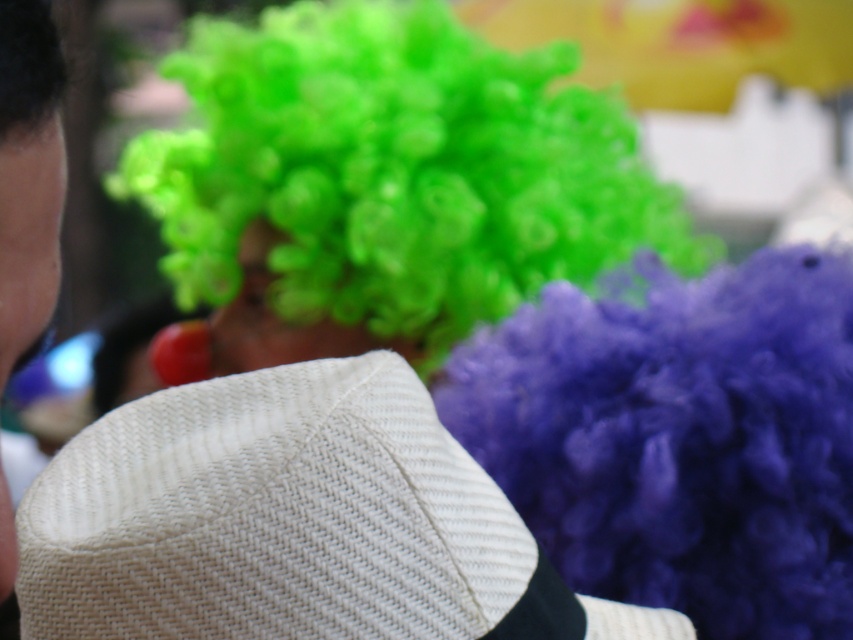
Based on the photo, you are a costume designer trying to arrange two white woven hats for a stage performance. You have a white woven straw hat at center and a white woven hat at left. Based on their positions, which hat should you adjust to ensure both are visible to the audience?

The white woven hat at left is behind the white woven straw hat at center, so you should adjust the white woven hat at left to move it forward so both hats are visible to the audience.

You are a photographer adjusting your camera to focus on the subject in the image. You notice two points marked at coordinates point (614,618) and point (1,145). Which point should you focus on to ensure the subject in the foreground is sharp?

You should focus on point (1,145) because it is in the foreground, while point (614,618) is behind it and out of focus.

You are a costume designer arranging two white woven hats for a stage performance. The hats are part of a character ensemble. You need to place them on a shelf such that the one on the left is the smaller one. Given that the white woven straw hat at center is to the right of the white woven hat at left, which hat should you place on the left side of the shelf?

You should place the white woven hat at left on the left side of the shelf because the white woven straw hat at center is to the right of it, indicating that the white woven hat at left is positioned to the left and is the smaller one.